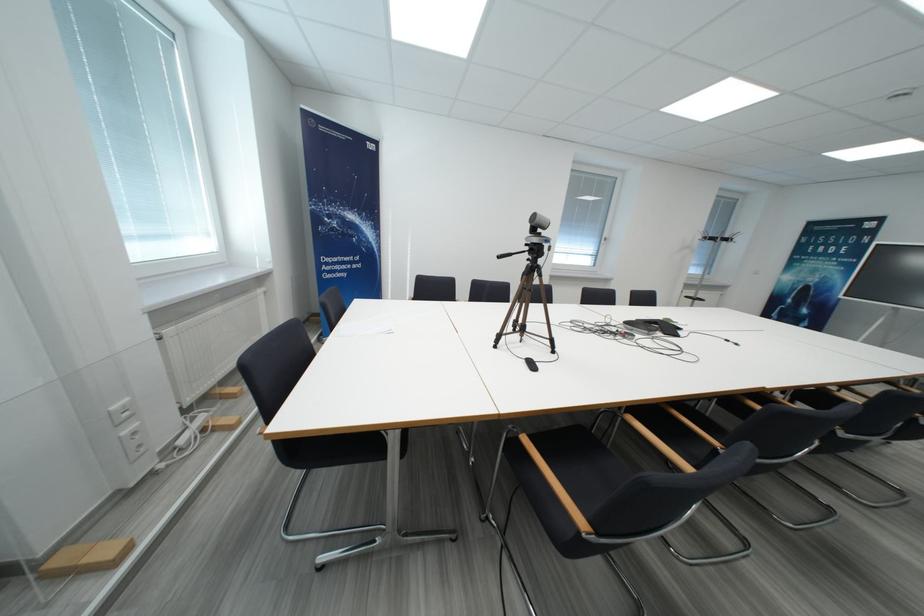
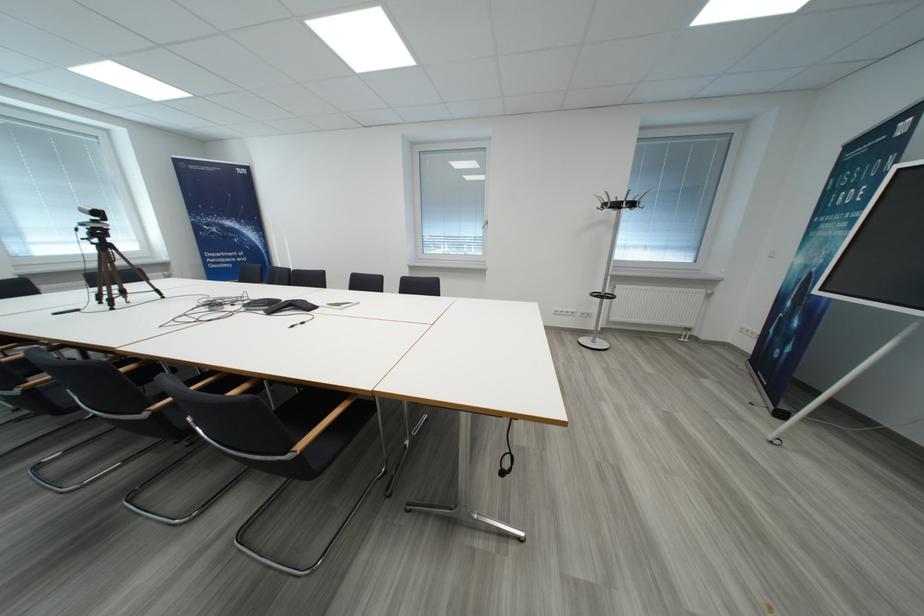
Locate, in the second image, the point that corresponds to [733,243] in the first image.

(623, 208)